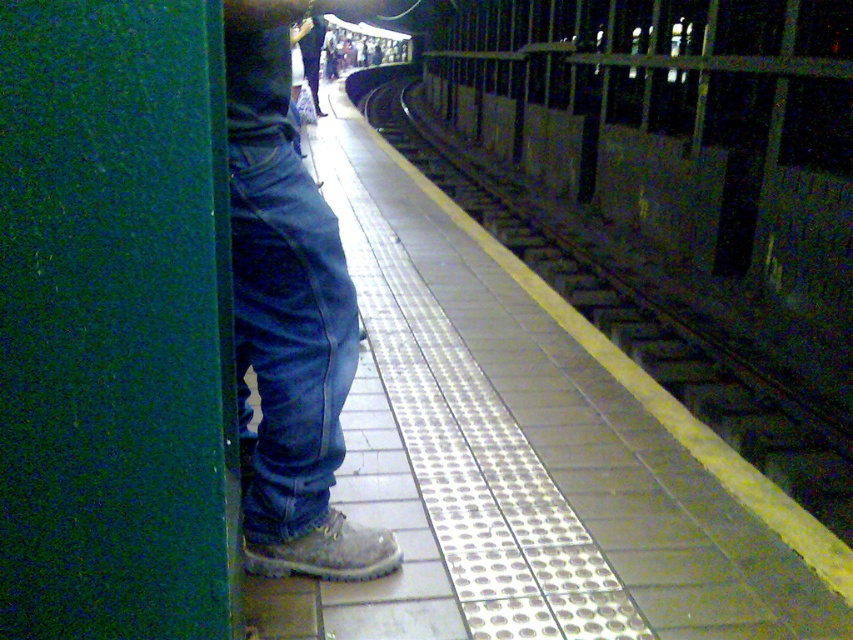
Looking at this image, you are a passenger waiting on the subway platform. You notice two points marked on the platform floor. The first point is at coordinate point (361,10) and the second is at point (763,445). If you are facing the direction the train is coming from, which point is closer to you?

Point (361,10) is in front of point (763,445), so if you are facing the direction the train is coming from, point (361,10) would be closer to you.

You are a passenger waiting on the subway platform. You see the point marked at coordinates (289, 314). What object is located at that point?

The point at coordinates (289, 314) has denim jeans at center.